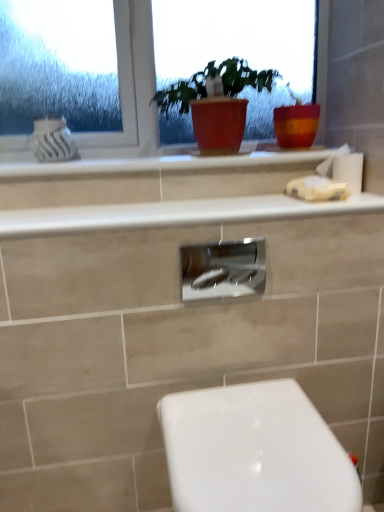
Where is `clear glass window at upper center`? This screenshot has height=512, width=384. clear glass window at upper center is located at coordinates tap(132, 79).

This screenshot has width=384, height=512. What are the coordinates of `white glossy counter top at upper center, the 2th counter top viewed from the top` in the screenshot? It's located at (177, 213).

Describe the element at coordinates (175, 163) in the screenshot. The width and height of the screenshot is (384, 512). I see `white glossy counter top at upper center, which ranks as the second counter top in bottom-to-top order` at that location.

The image size is (384, 512). What do you see at coordinates (215, 102) in the screenshot?
I see `matte red pot at center` at bounding box center [215, 102].

I want to click on clear glass window at upper center, so click(x=132, y=79).

You are a GUI agent. You are given a task and a screenshot of the screen. Output one action in this format:
    pyautogui.click(x=<x>, y=<y>)
    Task: Click on the window lying on the left of white glossy counter top at upper center, positioned as the first counter top in top-to-bottom order
    Image resolution: width=384 pixels, height=512 pixels.
    Given the screenshot: What is the action you would take?
    pyautogui.click(x=132, y=79)

Which is more to the left, white glossy counter top at upper center, which ranks as the second counter top in bottom-to-top order, or clear glass window at upper center?

From the viewer's perspective, clear glass window at upper center appears more on the left side.

Does point (216, 158) lie in front of point (138, 54)?

That is True.

From a real-world perspective, relative to clear glass window at upper center, is white glossy counter top at upper center, positioned as the first counter top in top-to-bottom order, vertically above or below?

white glossy counter top at upper center, positioned as the first counter top in top-to-bottom order, is situated lower than clear glass window at upper center in the real world.

What's the angular difference between white matte tissue at right and white glossy counter top at upper center, positioned as the first counter top in top-to-bottom order,'s facing directions?

white matte tissue at right and white glossy counter top at upper center, positioned as the first counter top in top-to-bottom order, are facing 1.3 degrees away from each other.

In terms of height, does white matte tissue at right look taller or shorter compared to white glossy counter top at upper center, positioned as the first counter top in top-to-bottom order?

In the image, white matte tissue at right appears to be taller than white glossy counter top at upper center, positioned as the first counter top in top-to-bottom order.

Does white matte tissue at right come behind white glossy counter top at upper center, which ranks as the second counter top in bottom-to-top order?

That is True.

Locate an element on the screen. This screenshot has width=384, height=512. tissue behind the white glossy counter top at upper center, which ranks as the second counter top in bottom-to-top order is located at coordinates (330, 178).

Considering the sizes of objects white glossy counter top at upper center, the 2th counter top viewed from the top, and white glossy toilet at lower right in the image provided, who is wider, white glossy counter top at upper center, the 2th counter top viewed from the top, or white glossy toilet at lower right?

With larger width is white glossy toilet at lower right.

Would you consider white glossy counter top at upper center, the 2th counter top viewed from the top, to be distant from white glossy toilet at lower right?

→ white glossy counter top at upper center, the 2th counter top viewed from the top, is near white glossy toilet at lower right, not far away.

This screenshot has width=384, height=512. In order to click on toilet below the white glossy counter top at upper center, the 1th counter top from the bottom (from the image's perspective) in this screenshot , I will do `click(254, 451)`.

Is white glossy counter top at upper center, the 1th counter top from the bottom, spatially inside white glossy toilet at lower right, or outside of it?

white glossy counter top at upper center, the 1th counter top from the bottom, is not enclosed by white glossy toilet at lower right.

From a real-world perspective, is matte red pot at center located higher than white matte tissue at right?

Yes, from a real-world perspective, matte red pot at center is above white matte tissue at right.

Is matte red pot at center far away from white matte tissue at right?

No.

Considering the sizes of matte red pot at center and white matte tissue at right in the image, is matte red pot at center taller or shorter than white matte tissue at right?

matte red pot at center is taller than white matte tissue at right.

Considering the relative positions of satin nickel faucet at center and white matte tissue at right in the image provided, is satin nickel faucet at center to the right of white matte tissue at right from the viewer's perspective?

No, satin nickel faucet at center is not to the right of white matte tissue at right.

What's the angular difference between satin nickel faucet at center and white matte tissue at right's facing directions?

The angle between the facing direction of satin nickel faucet at center and the facing direction of white matte tissue at right is 1.05 degrees.

Is satin nickel faucet at center facing towards white matte tissue at right?

No, satin nickel faucet at center is not facing towards white matte tissue at right.

From the image's perspective, does satin nickel faucet at center appear lower than white matte tissue at right?

Yes, from the image's perspective, satin nickel faucet at center is beneath white matte tissue at right.

Is matte red pot at center looking in the opposite direction of satin nickel faucet at center?

matte red pot at center does not have its back to satin nickel faucet at center.

Is matte red pot at center positioned in front of satin nickel faucet at center?

No, matte red pot at center is behind satin nickel faucet at center.

This screenshot has height=512, width=384. I want to click on cabinet below the matte red pot at center (from a real-world perspective), so click(222, 269).

From a real-world perspective, is white glossy counter top at upper center, which ranks as the second counter top in bottom-to-top order, on top of white glossy counter top at upper center, the 1th counter top from the bottom?

Correct, in the physical world, white glossy counter top at upper center, which ranks as the second counter top in bottom-to-top order, is higher than white glossy counter top at upper center, the 1th counter top from the bottom.

Is white glossy counter top at upper center, positioned as the first counter top in top-to-bottom order, completely or partially outside of white glossy counter top at upper center, the 1th counter top from the bottom?

Yes.

Is white glossy counter top at upper center, positioned as the first counter top in top-to-bottom order, facing away from white glossy counter top at upper center, the 2th counter top viewed from the top?

white glossy counter top at upper center, positioned as the first counter top in top-to-bottom order, is not turned away from white glossy counter top at upper center, the 2th counter top viewed from the top.

From the image's perspective, which is above, white glossy counter top at upper center, which ranks as the second counter top in bottom-to-top order, or white glossy counter top at upper center, the 2th counter top viewed from the top?

From the image's view, white glossy counter top at upper center, which ranks as the second counter top in bottom-to-top order, is above.

Find the location of `counter top that is the 1st one when counting forward from the clear glass window at upper center`. counter top that is the 1st one when counting forward from the clear glass window at upper center is located at coordinates (175, 163).

This screenshot has width=384, height=512. I want to click on counter top located above the white matte tissue at right (from a real-world perspective), so click(175, 163).

Based on their spatial positions, is satin nickel faucet at center or white glossy counter top at upper center, the 2th counter top viewed from the top, further from matte red pot at center?

The object further to matte red pot at center is satin nickel faucet at center.

Estimate the real-world distances between objects in this image. Which object is further from matte red pot at center, white glossy toilet at lower right or clear glass window at upper center?

white glossy toilet at lower right is further to matte red pot at center.

From the image, which object appears to be nearer to white matte tissue at right, white glossy toilet at lower right or satin nickel faucet at center?

The object closer to white matte tissue at right is satin nickel faucet at center.

When comparing their distances from white glossy counter top at upper center, which ranks as the second counter top in bottom-to-top order, does white glossy toilet at lower right or satin nickel faucet at center seem closer?

satin nickel faucet at center is positioned closer to the anchor white glossy counter top at upper center, which ranks as the second counter top in bottom-to-top order.

Estimate the real-world distances between objects in this image. Which object is closer to white glossy counter top at upper center, the 1th counter top from the bottom, clear glass window at upper center or satin nickel faucet at center?

The object closer to white glossy counter top at upper center, the 1th counter top from the bottom, is satin nickel faucet at center.

When comparing their distances from white matte tissue at right, does clear glass window at upper center or white glossy counter top at upper center, which ranks as the second counter top in bottom-to-top order, seem closer?

The object closer to white matte tissue at right is white glossy counter top at upper center, which ranks as the second counter top in bottom-to-top order.

From the image, which object appears to be farther from satin nickel faucet at center, white glossy toilet at lower right or matte red pot at center?

The object further to satin nickel faucet at center is matte red pot at center.

Based on their spatial positions, is clear glass window at upper center or white matte tissue at right further from white glossy counter top at upper center, which ranks as the second counter top in bottom-to-top order?

clear glass window at upper center.

Locate an element on the screen. cabinet between matte red pot at center and white glossy toilet at lower right in the up-down direction is located at coordinates click(x=222, y=269).

I want to click on houseplant between clear glass window at upper center and white glossy toilet at lower right in the up-down direction, so click(215, 102).

I want to click on houseplant situated between clear glass window at upper center and white matte tissue at right from left to right, so click(x=215, y=102).

Find the location of a particular element. The width and height of the screenshot is (384, 512). cabinet situated between white glossy counter top at upper center, which ranks as the second counter top in bottom-to-top order, and white matte tissue at right from left to right is located at coordinates (222, 269).